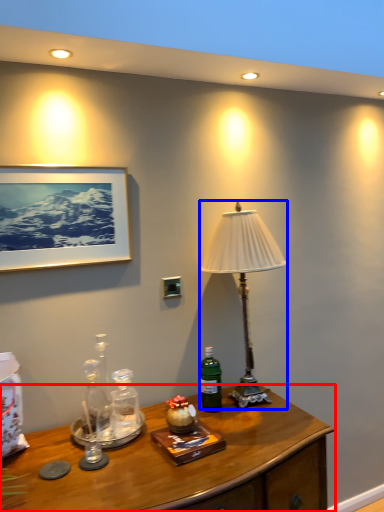
Question: Which point is further to the camera, desk (highlighted by a red box) or lamp (highlighted by a blue box)?

Choices:
 (A) desk
 (B) lamp

Answer: (B)